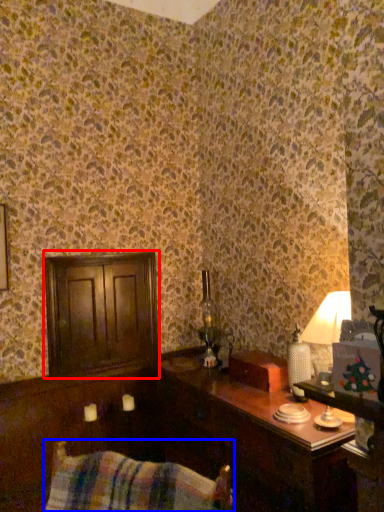
Question: Among these objects, which one is nearest to the camera, dresser (highlighted by a red box) or swivel chair (highlighted by a blue box)?

Choices:
 (A) dresser
 (B) swivel chair

Answer: (B)